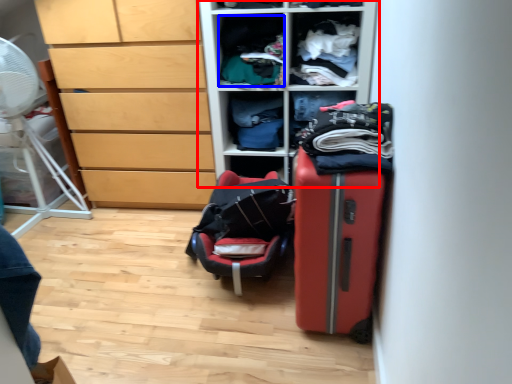
Question: Among these objects, which one is nearest to the camera, furniture (highlighted by a red box) or clothing (highlighted by a blue box)?

Choices:
 (A) furniture
 (B) clothing

Answer: (A)